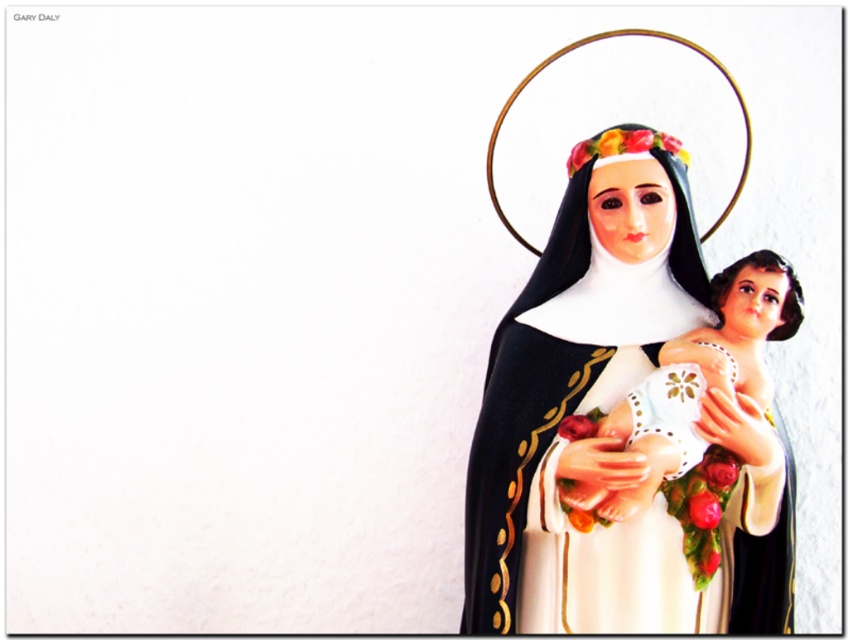
Can you confirm if matte porcelain statue at right is taller than white lace baby at center?

Correct, matte porcelain statue at right is much taller as white lace baby at center.

Describe the element at coordinates (612, 436) in the screenshot. I see `matte porcelain statue at right` at that location.

Which is behind, point (693, 246) or point (645, 429)?

The point (693, 246) is behind.

What are the coordinates of `matte porcelain statue at right` in the screenshot? It's located at (612, 436).